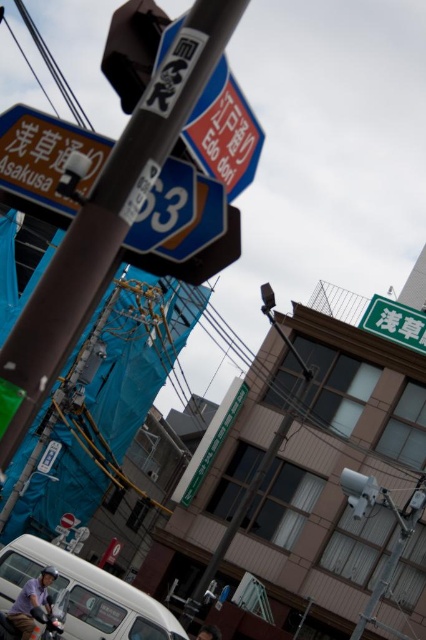
You are a delivery person needing to attach a new sign to the traffic pole. The new sign must be placed above the metallic wire at center but below the green matte signboard at upper right. Is there enough space between them for the new sign?

The metallic wire at center is positioned under the green matte signboard at upper right, so there is space between them for the new sign to be placed above the metallic wire at center and below the green matte signboard at upper right.

You are standing at the origin point of the coordinate system. You want to walk to the metallic pole at center. Which direction should you walk?

The metallic pole at center is located at coordinate point (103, 227), so you should walk northeast to reach it.

You are a delivery drone that needs to fly through the space between the metallic wire at center and the green matte signboard at upper right. Can you pass through vertically without touching either?

The metallic wire at center is taller than green matte signboard at upper right, so there is vertical clearance between them. The drone can pass through vertically as long as it stays below the metallic wire at center and above the green matte signboard at upper right.